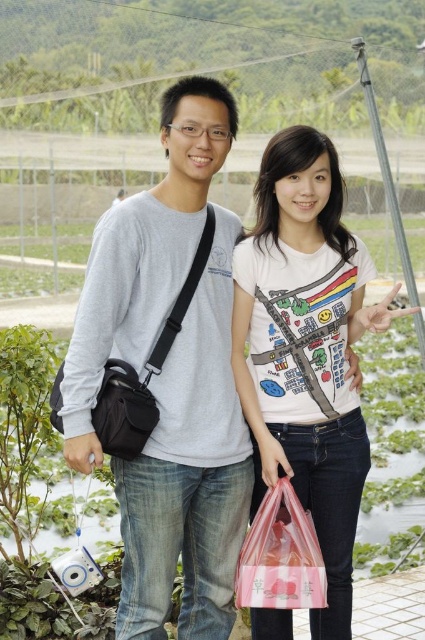
You are a photographer trying to capture a closeup of the gray matte shirt at center and the translucent plastic bag at lower center in the image. What is the minimum distance you need to set your camera lens to focus on both objects clearly?

The gray matte shirt at center and the translucent plastic bag at lower center are 56.78 centimeters apart from each other. To focus on both clearly, the camera lens should be set to a distance that accommodates this separation, ensuring both are within the depth of field.